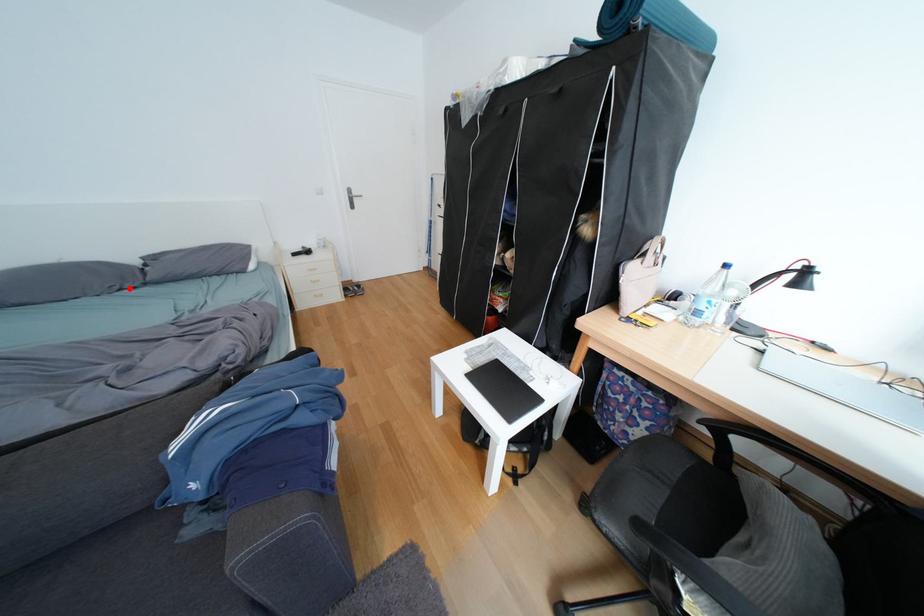
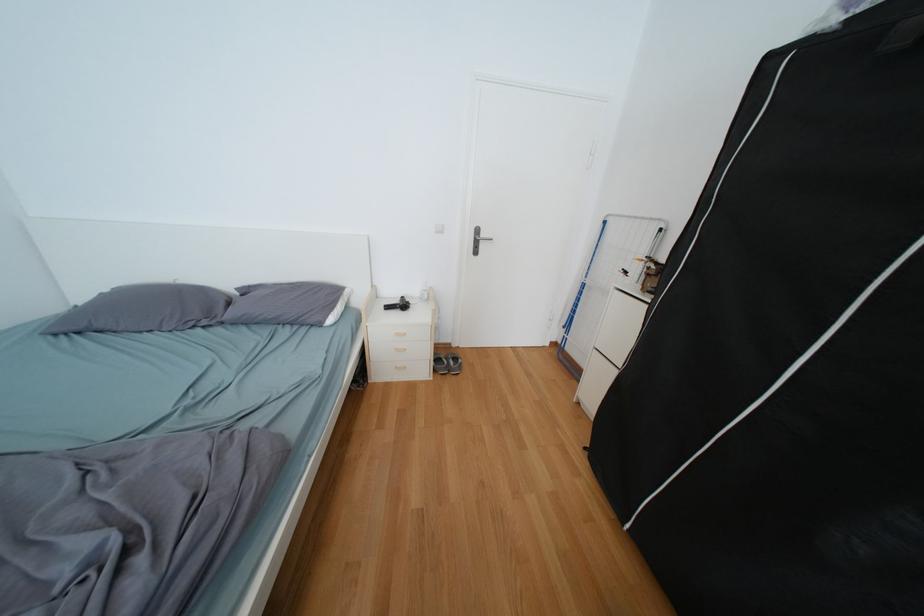
The point at the highlighted location is marked in the first image. Where is the corresponding point in the second image?

(204, 323)